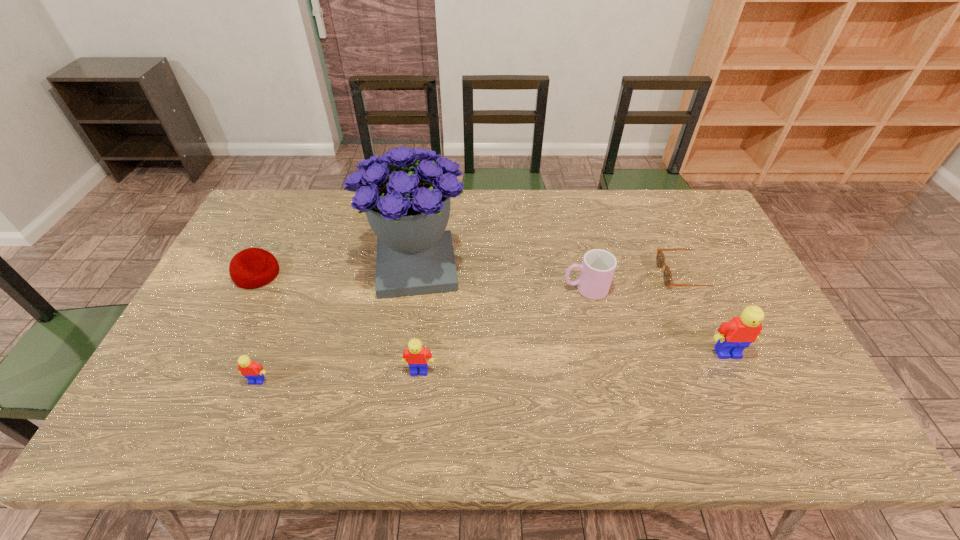
To make them evenly spaced by inserting another Lego among them, please locate a free space for this new Lego. Please provide its 2D coordinates. Your answer should be formatted as a tuple, i.e. [(x, y)], where the tuple contains the x and y coordinates of a point satisfying the conditions above.

[(576, 362)]